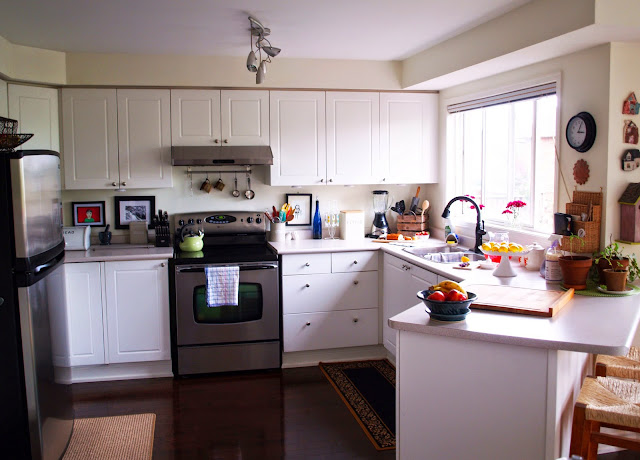
The width and height of the screenshot is (640, 460). What are the coordinates of `bowl of fruit` in the screenshot? It's located at (443, 312).